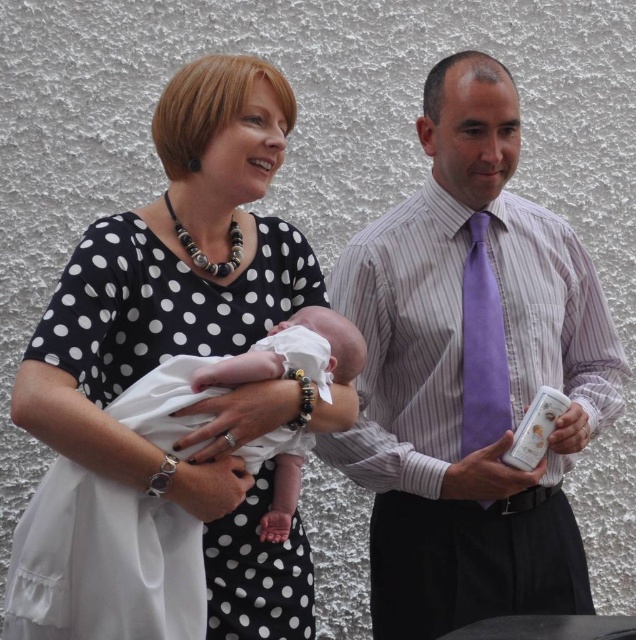
Does purple striped shirt at center appear on the right side of white polka dot dress at center?

Yes, purple striped shirt at center is to the right of white polka dot dress at center.

This screenshot has width=636, height=640. What do you see at coordinates (471, 374) in the screenshot? I see `purple striped shirt at center` at bounding box center [471, 374].

This screenshot has width=636, height=640. Find the location of `purple striped shirt at center`. purple striped shirt at center is located at coordinates (471, 374).

Is point (127, 442) positioned before point (481, 259)?

Yes, point (127, 442) is in front of point (481, 259).

Can you confirm if white polka dot dress at center is bigger than purple suede tie at right?

Yes.

Find the location of a particular element. white polka dot dress at center is located at coordinates click(x=193, y=336).

Locate an element on the screen. The width and height of the screenshot is (636, 640). white polka dot dress at center is located at coordinates (193, 336).

Image resolution: width=636 pixels, height=640 pixels. I want to click on white soft cloth at center, so [x=287, y=353].

Is white soft cloth at center shorter than purple suede tie at right?

Yes, white soft cloth at center is shorter than purple suede tie at right.

The image size is (636, 640). In order to click on white soft cloth at center in this screenshot , I will do `click(287, 353)`.